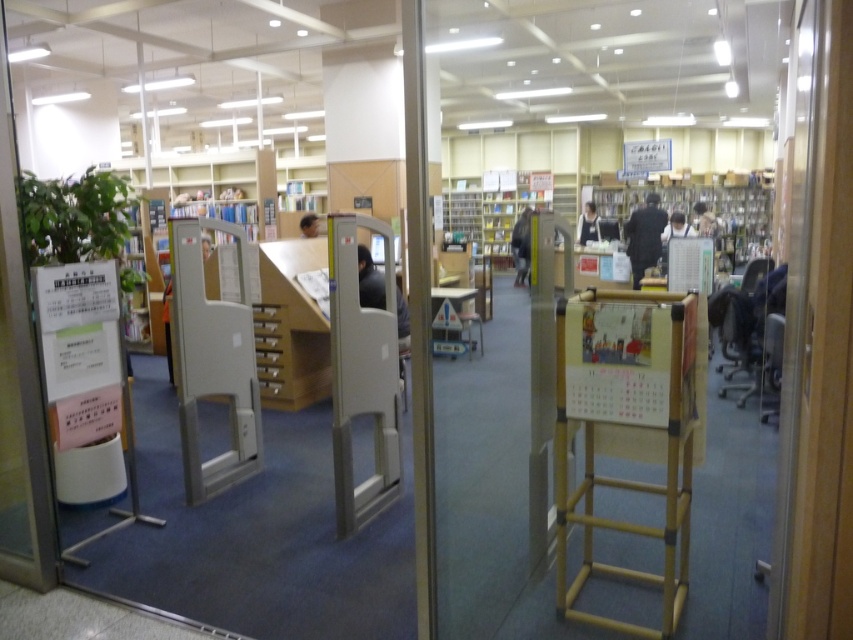
Question: Considering the real-world distances, which object is closest to the dark gray coat at center?

Choices:
 (A) matte black laptop at center
 (B) dark blue shirt at center
 (C) dark gray plastic chair at center
 (D) wooden bookshelf at center

Answer: (B)

Question: Estimate the real-world distances between objects in this image. Which object is closer to the wooden stool at center?

Choices:
 (A) dark gray jacket at center
 (B) wooden bookshelf at center

Answer: (A)

Question: Can you confirm if wooden stool at center is positioned to the left of smooth gray computer at center?

Choices:
 (A) no
 (B) yes

Answer: (A)

Question: Which point is closer to the camera taking this photo?

Choices:
 (A) (364, 250)
 (B) (627, 189)
 (C) (683, 224)
 (D) (480, 337)

Answer: (A)

Question: Can you confirm if dark gray sweater at center is bigger than wooden stool at center?

Choices:
 (A) no
 (B) yes

Answer: (B)

Question: Does dark gray coat at center come in front of wooden stool at center?

Choices:
 (A) yes
 (B) no

Answer: (B)